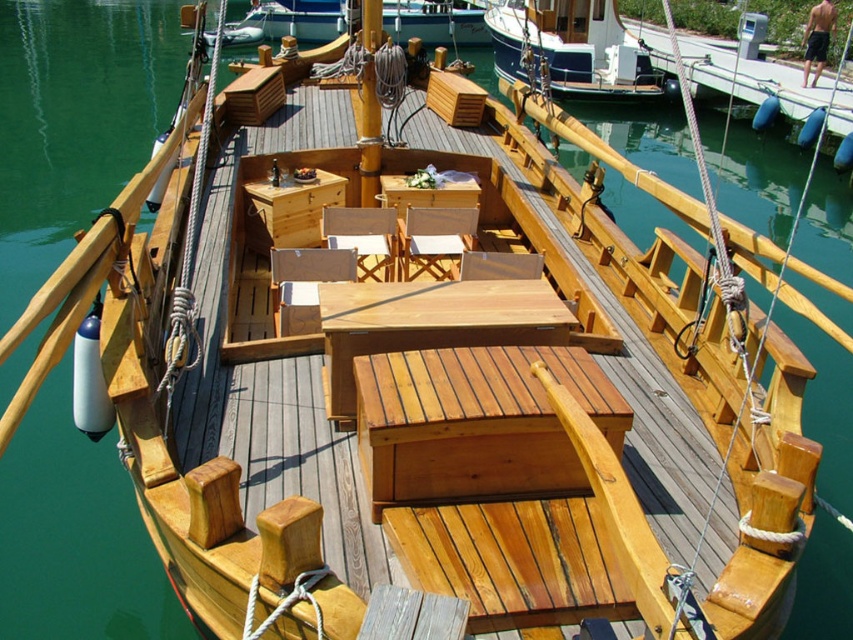
You are a sailor on the deck of the boat. You need to secure a rope to the white painted wood boat at upper center, but you must avoid the smooth wood mast at center. Which direction should you move to reach the boat without hitting the mast?

The white painted wood boat at upper center is located above the smooth wood mast at center. To avoid the mast, you should move upwards towards the boat.

You are planning to place a rectangular table on the deck of the boat. The table requires a space that is wider than the smooth wood mast at center. Can the natural wood bench at center provide enough width for the table?

The natural wood bench at center has a width larger than the smooth wood mast at center, so yes, the natural wood bench at center can provide enough width for the table.